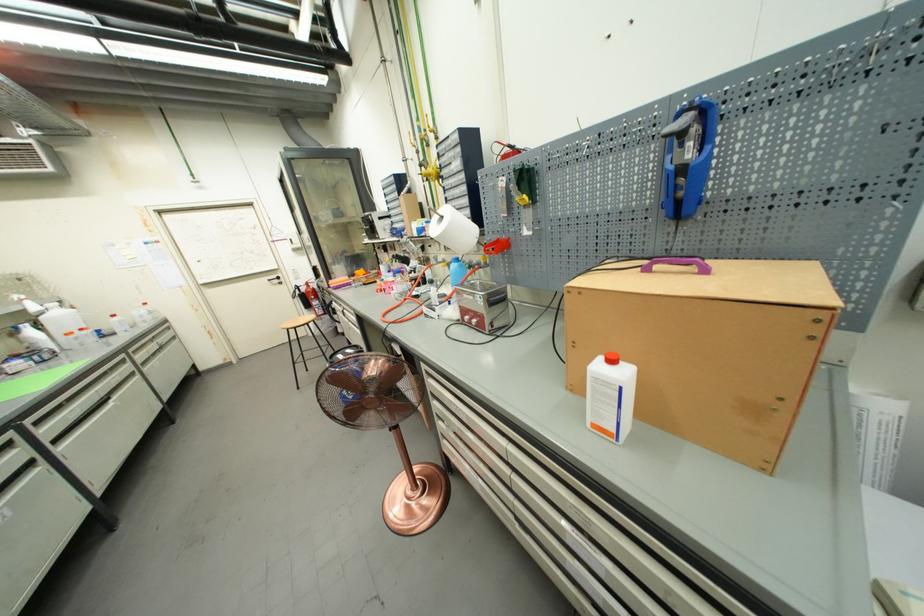
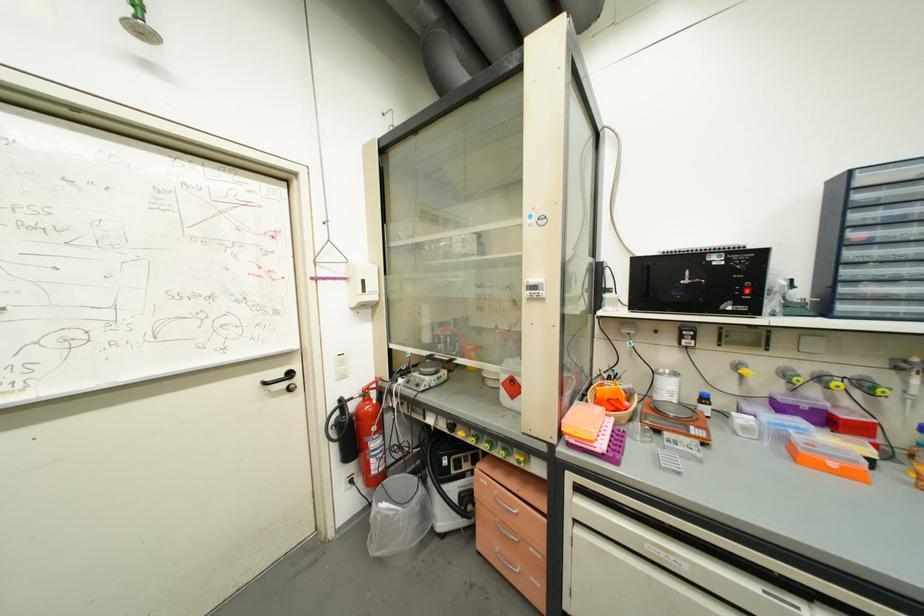
Locate, in the second image, the point that corresponds to pixel 285 286 in the first image.

(293, 398)